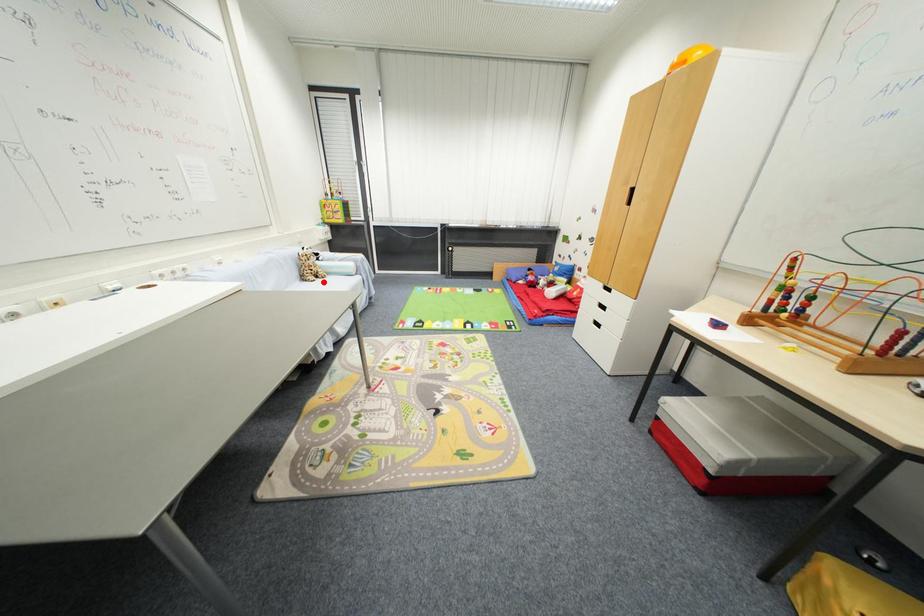
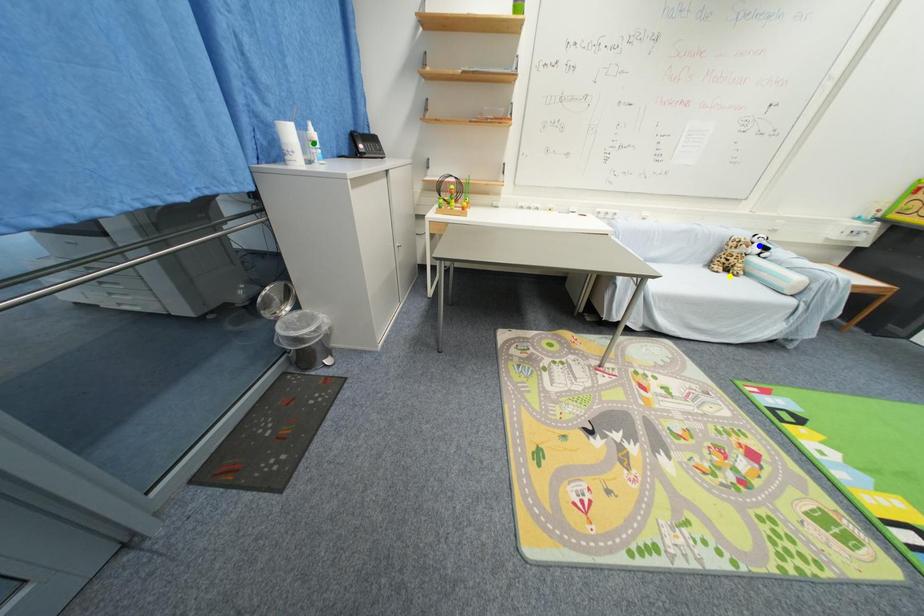
Question: I am providing you with two images of the same scene from different viewpoints. A red point is marked on the first image. You are given multiple points on the second image. Which point in image 2 is actually the same real-world point as the red point in image 1?

Choices:
 (A) blue point
 (B) yellow point
 (C) green point

Answer: (B)